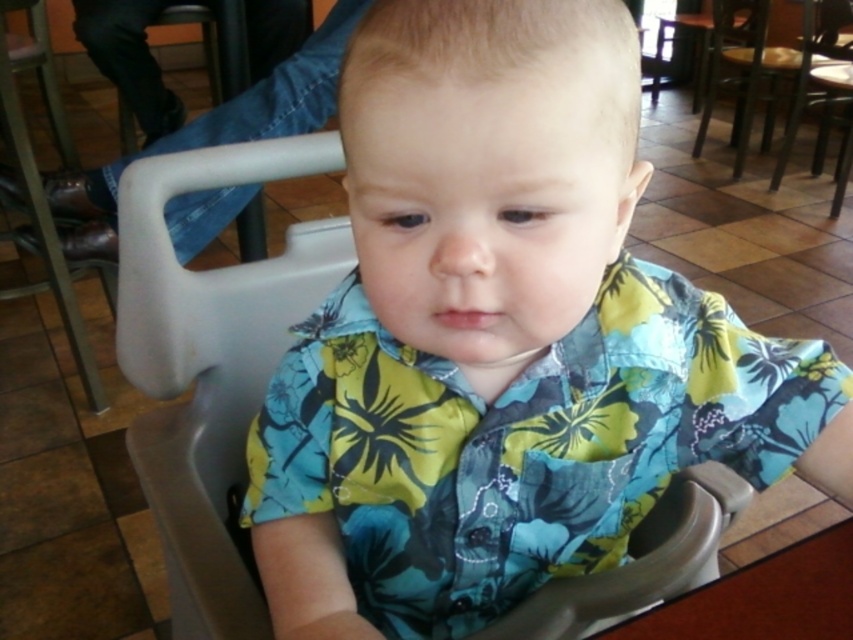
You are a parent trying to choose between placing your child in the gray plastic chair at center or the wooden chair at center. Which chair is shorter?

The gray plastic chair at center is shorter than the wooden chair at center.

You are a parent trying to place a toy on the table. The toy is too heavy to lift. You can only push it from the gray plastic chair at center to the brown wooden table at lower right. Will the toy slide down to the table?

The gray plastic chair at center is above the brown wooden table at lower right, so yes, the toy will slide down to the table if pushed from the gray plastic chair at center to the brown wooden table at lower right.